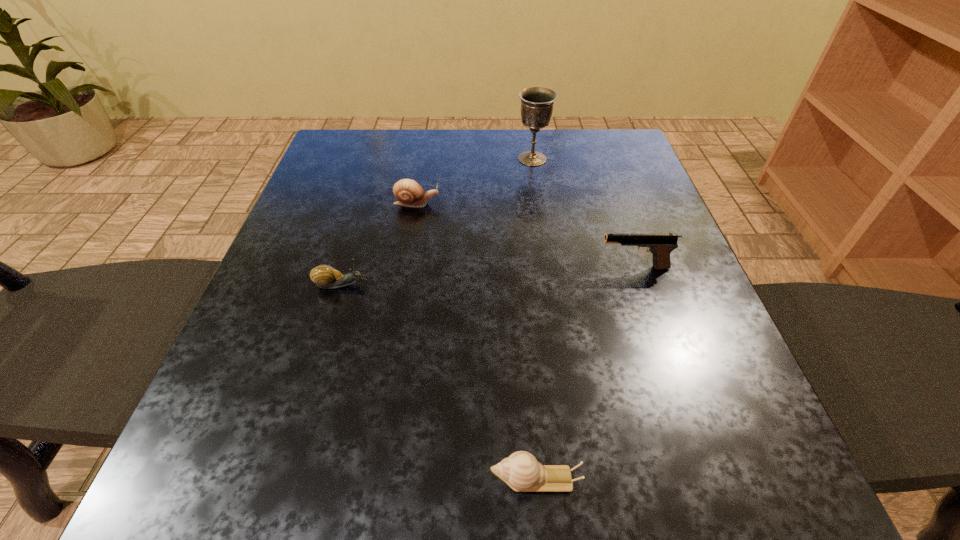
Locate which object ranks fourth in proximity to the second escargot from left to right. Please provide its 2D coordinates. Your answer should be formatted as a tuple, i.e. [(x, y)], where the tuple contains the x and y coordinates of a point satisfying the conditions above.

[(521, 471)]

The width and height of the screenshot is (960, 540). What are the coordinates of `escargot that is the second closest to the farthest escargot` in the screenshot? It's located at (521, 471).

Locate which escargot ranks second in proximity to the second nearest escargot. Please provide its 2D coordinates. Your answer should be formatted as a tuple, i.e. [(x, y)], where the tuple contains the x and y coordinates of a point satisfying the conditions above.

[(521, 471)]